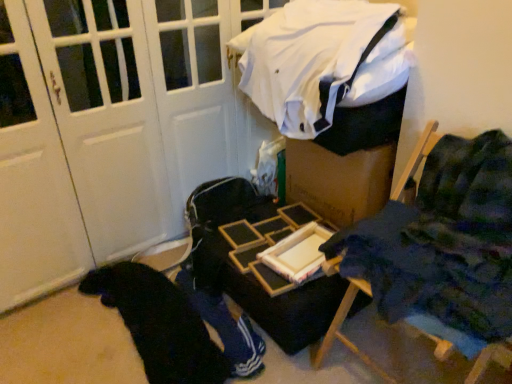
What is the approximate height of blue fabric chair at right?

It is 30.49 inches.

The image size is (512, 384). I want to click on white fabric at upper center, so click(x=313, y=59).

This screenshot has width=512, height=384. What do you see at coordinates (159, 324) in the screenshot?
I see `black fabric at lower left` at bounding box center [159, 324].

Where is `blue fabric chair at right`? The width and height of the screenshot is (512, 384). blue fabric chair at right is located at coordinates (343, 335).

Is black fabric at lower left aimed at blue fabric chair at right?

No, black fabric at lower left is not facing towards blue fabric chair at right.

From the image's perspective, does black fabric at lower left appear higher than blue fabric chair at right?

Actually, black fabric at lower left appears below blue fabric chair at right in the image.

Can you confirm if black fabric at lower left is positioned to the right of blue fabric chair at right?

No.

Does point (179, 363) appear closer or farther from the camera than point (503, 350)?

Point (179, 363) appears to be farther away from the viewer than point (503, 350).

Is point (356, 289) closer to viewer compared to point (206, 378)?

Yes, it is.

Is blue fabric chair at right placed right next to black fabric at lower left?

No, blue fabric chair at right is not making contact with black fabric at lower left.

Is blue fabric chair at right oriented away from black fabric at lower left?

blue fabric chair at right does not have its back to black fabric at lower left.

Is blue fabric chair at right to the right of black fabric at lower left from the viewer's perspective?

Yes.

From a real-world perspective, is blue fabric chair at right positioned under white fabric at upper center based on gravity?

Yes, from a real-world perspective, blue fabric chair at right is under white fabric at upper center.

How different are the orientations of blue fabric chair at right and white fabric at upper center in degrees?

The angle between the facing direction of blue fabric chair at right and the facing direction of white fabric at upper center is 2.64 degrees.

Which is more to the right, blue fabric chair at right or white fabric at upper center?

blue fabric chair at right is more to the right.

Is blue fabric chair at right positioned behind white fabric at upper center?

No, it is not.

Does white fabric at upper center have a lesser height compared to blue fabric chair at right?

Indeed, white fabric at upper center has a lesser height compared to blue fabric chair at right.

From the image's perspective, would you say white fabric at upper center is shown under blue fabric chair at right?

Incorrect, from the image's perspective, white fabric at upper center is higher than blue fabric chair at right.

In the image, there is a blue fabric chair at right. Where is `laundry above it (from the image's perspective)`? Image resolution: width=512 pixels, height=384 pixels. laundry above it (from the image's perspective) is located at coordinates point(313,59).

Considering the positions of objects white fabric at upper center and blue fabric chair at right in the image provided, who is in front, white fabric at upper center or blue fabric chair at right?

Positioned in front is blue fabric chair at right.

Is white fabric at upper center turned away from wooden tray at center?

No, wooden tray at center is not at the back of white fabric at upper center.

Based on the photo, considering the sizes of objects white fabric at upper center and wooden tray at center in the image provided, who is shorter, white fabric at upper center or wooden tray at center?

wooden tray at center.

From a real-world perspective, is white fabric at upper center physically located above or below wooden tray at center?

white fabric at upper center is situated higher than wooden tray at center in the real world.

At what (x,y) coordinates should I click in order to perform the action: click on furniture that is in front of the wooden tray at center. Please return your answer as a coordinate pair (x, y). This screenshot has width=512, height=384. Looking at the image, I should click on [x=343, y=335].

Between blue fabric chair at right and wooden tray at center, which one appears on the right side from the viewer's perspective?

Positioned to the right is blue fabric chair at right.

Is blue fabric chair at right far away from wooden tray at center?

blue fabric chair at right is actually quite close to wooden tray at center.

Which is more to the right, black fabric at lower left or wooden tray at center?

wooden tray at center.

Would you say black fabric at lower left is inside or outside wooden tray at center?

black fabric at lower left exists outside the volume of wooden tray at center.

This screenshot has height=384, width=512. Identify the location of table behind the black fabric at lower left. (255, 277).

Is black fabric at lower left facing towards wooden tray at center?

No, black fabric at lower left does not turn towards wooden tray at center.

The width and height of the screenshot is (512, 384). What are the coordinates of `clothing that is below the blue fabric chair at right (from the image's perspective)` in the screenshot? It's located at (159, 324).

Locate an element on the screen. furniture on the right of black fabric at lower left is located at coordinates (343, 335).

Looking at the image, which one is located further to white fabric at upper center, black fabric at lower left or blue fabric chair at right?

black fabric at lower left is positioned further to the anchor white fabric at upper center.

When comparing their distances from white fabric at upper center, does wooden tray at center or black fabric at lower left seem further?

black fabric at lower left is further to white fabric at upper center.

When comparing their distances from wooden tray at center, does blue fabric chair at right or white fabric at upper center seem closer?

blue fabric chair at right is closer to wooden tray at center.

Which object lies further to the anchor point black fabric at lower left, wooden tray at center or white fabric at upper center?

Among the two, white fabric at upper center is located further to black fabric at lower left.

Based on their spatial positions, is white fabric at upper center or black fabric at lower left closer to wooden tray at center?

Among the two, black fabric at lower left is located nearer to wooden tray at center.

Estimate the real-world distances between objects in this image. Which object is closer to blue fabric chair at right, wooden tray at center or white fabric at upper center?

The object closer to blue fabric chair at right is wooden tray at center.

Estimate the real-world distances between objects in this image. Which object is closer to wooden tray at center, blue fabric chair at right or black fabric at lower left?

Based on the image, black fabric at lower left appears to be nearer to wooden tray at center.

Considering their positions, is black fabric at lower left positioned closer to blue fabric chair at right than wooden tray at center?

wooden tray at center lies closer to blue fabric chair at right than the other object.

Where is `furniture between white fabric at upper center and black fabric at lower left from top to bottom`? furniture between white fabric at upper center and black fabric at lower left from top to bottom is located at coordinates (343, 335).

The width and height of the screenshot is (512, 384). Identify the location of table between white fabric at upper center and black fabric at lower left vertically. (255, 277).

You are a GUI agent. You are given a task and a screenshot of the screen. Output one action in this format:
    pyautogui.click(x=<x>, y=<y>)
    Task: Click on the furniture between white fabric at upper center and wooden tray at center in the up-down direction
    
    Given the screenshot: What is the action you would take?
    pyautogui.click(x=343, y=335)

This screenshot has width=512, height=384. Identify the location of table located between black fabric at lower left and blue fabric chair at right in the left-right direction. (255, 277).